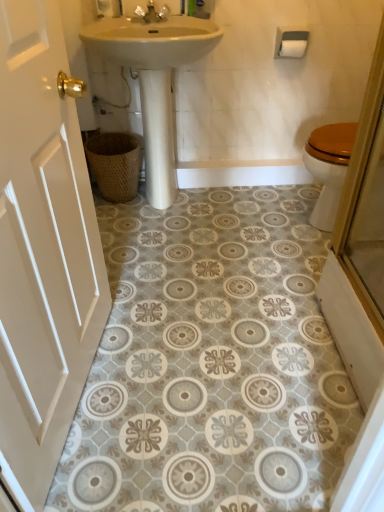
Question: Looking at their shapes, would you say white matte toilet paper at upper right is wider or thinner than matte gold faucet at upper center?

Choices:
 (A) thin
 (B) wide

Answer: (A)

Question: Considering the relative positions of white matte toilet paper at upper right and matte gold faucet at upper center in the image provided, is white matte toilet paper at upper right to the left or to the right of matte gold faucet at upper center?

Choices:
 (A) left
 (B) right

Answer: (B)

Question: Estimate the real-world distances between objects in this image. Which object is farther from the white matte toilet paper at upper right?

Choices:
 (A) matte gold faucet at upper center
 (B) white painted wood door at left
 (C) woven brown basket at lower left
 (D) white glossy sink at upper center

Answer: (B)

Question: Which of these objects is positioned farthest from the woven brown basket at lower left?

Choices:
 (A) matte gold faucet at upper center
 (B) white painted wood door at left
 (C) white matte toilet paper at upper right
 (D) white glossy sink at upper center

Answer: (B)